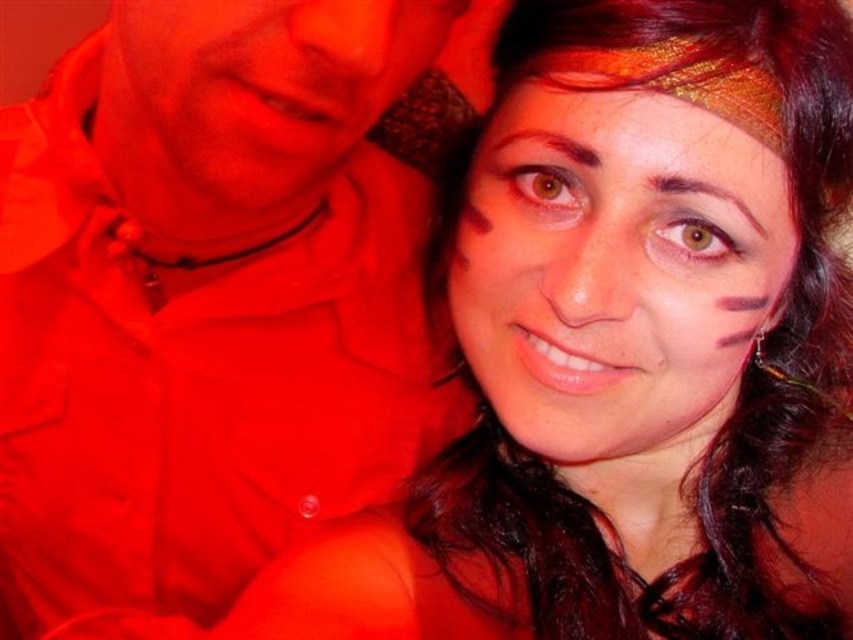
Can you confirm if matte red shirt at upper left is positioned above matte red face at upper left?

Incorrect, matte red shirt at upper left is not positioned above matte red face at upper left.

Does matte red shirt at upper left have a greater height compared to matte red face at upper left?

Yes, matte red shirt at upper left is taller than matte red face at upper left.

The image size is (853, 640). Identify the location of matte red shirt at upper left. (206, 304).

Who is shorter, matte red shirt at upper left or matte gold headband at upper center?

matte gold headband at upper center is shorter.

Which is in front, point (166, 568) or point (746, 248)?

Point (746, 248) is in front.

Find the location of `matte red shirt at upper left`. matte red shirt at upper left is located at coordinates (206, 304).

Based on the photo, is matte gold headband at upper center below matte red face at upper left?

Yes, matte gold headband at upper center is below matte red face at upper left.

Can you confirm if matte gold headband at upper center is taller than matte red face at upper left?

Yes.

What do you see at coordinates (614, 272) in the screenshot?
I see `matte gold headband at upper center` at bounding box center [614, 272].

Locate an element on the screen. The height and width of the screenshot is (640, 853). matte gold headband at upper center is located at coordinates (614, 272).